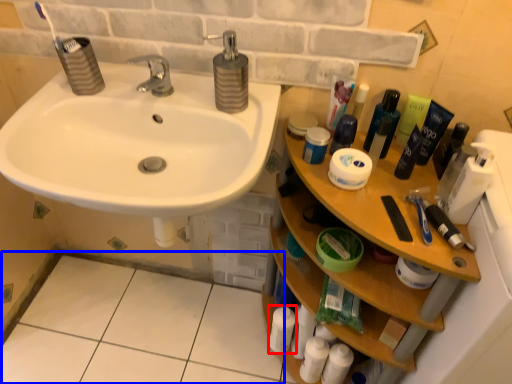
Question: Which object is closer to the camera taking this photo, toiletry (highlighted by a red box) or tile (highlighted by a blue box)?

Choices:
 (A) toiletry
 (B) tile

Answer: (B)